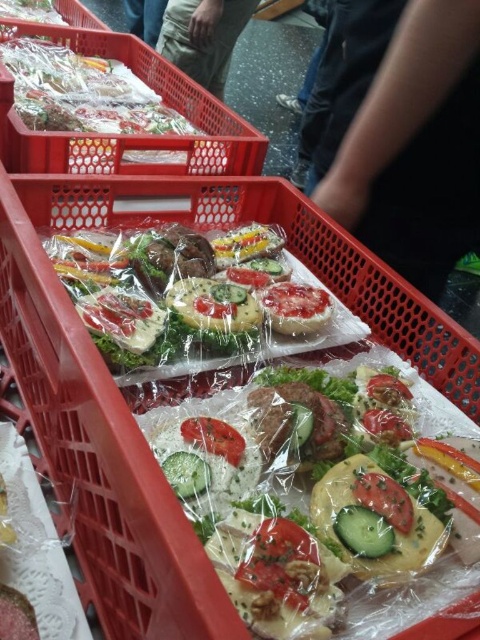
You are a delivery person trying to deliver a package to the translucent plastic salad at center. Your drone can only fly within 50 centimeters. Can the drone reach the salad?

The distance between the translucent plastic salad at center and the camera is 47.45 centimeters, so yes, the drone can reach the salad since it is within the 50 centimeter limit.

Where are the clear plastic sandwiches at center located in the image?

The clear plastic sandwiches at center are located at point (x=122, y=396) in the image.

In the scene shown: You are a delivery person who needs to pack these items into a box. The box can only hold items that are smaller than 12 inches in length. You see the clear plastic sandwiches at center and the translucent plastic salad at center. Which item can you safely place in the box?

The translucent plastic salad at center can be safely placed in the box because it is smaller in size than the clear plastic sandwiches at center, which may exceed the 12 inch length limit.